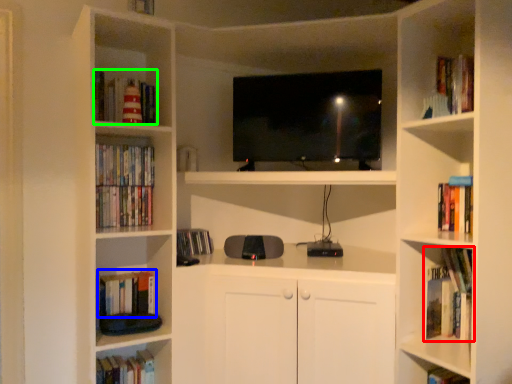
Question: Which object is positioned farthest from book (highlighted by a red box)? Select from book (highlighted by a blue box) and book (highlighted by a green box).

Choices:
 (A) book
 (B) book

Answer: (B)